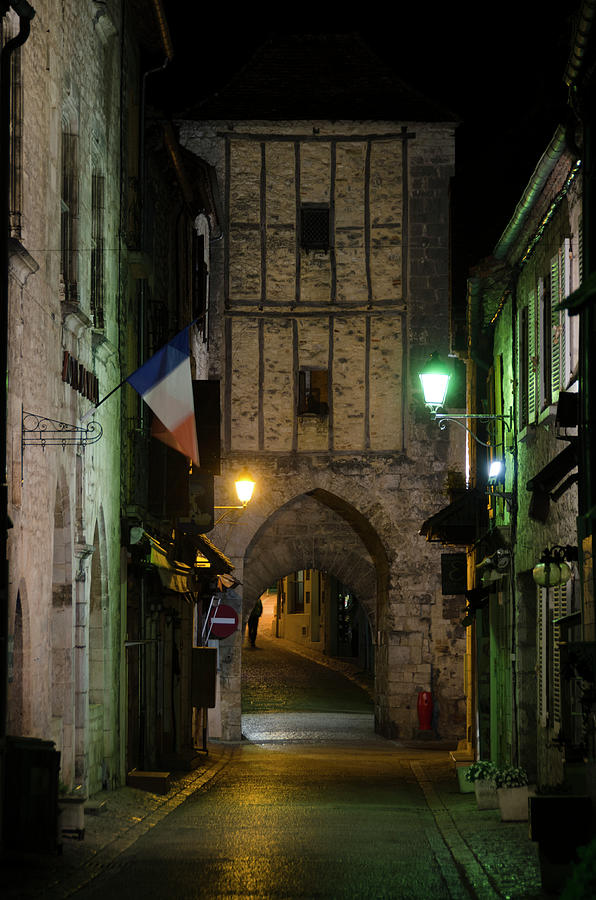
The height and width of the screenshot is (900, 596). I want to click on red vase, so click(x=429, y=706).